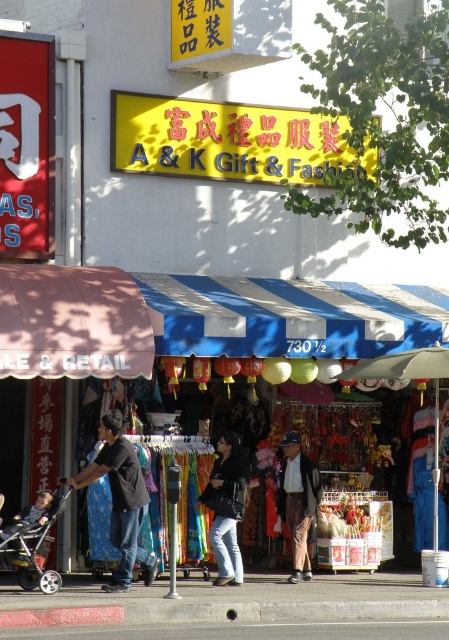
You are a delivery person trying to locate the A and K Gift and Fashion store. You see a yellow matte sign at upper center and a red sign on the left side. According to the coordinates provided, which sign is closer to the top edge of the image?

The yellow matte sign at upper center is closer to the top edge of the image because its y coordinate is 0.499, which is closer to 0.5 than the red sign on the left side which is positioned lower.

You are a customer in this store and want to buy the black matte shirt at center. However, you need to know if it can fit inside the metallic silver stroller at lower left. Can it fit?

The black matte shirt at center has a smaller size compared to metallic silver stroller at lower left, so it can fit inside the metallic silver stroller at lower left.

You are a customer browsing jackets in the shop. You see a denim jacket at center and a brown leather jacket at center. Which jacket is shorter in height?

The denim jacket at center is not as tall as the brown leather jacket at center, so the denim jacket at center is shorter in height.